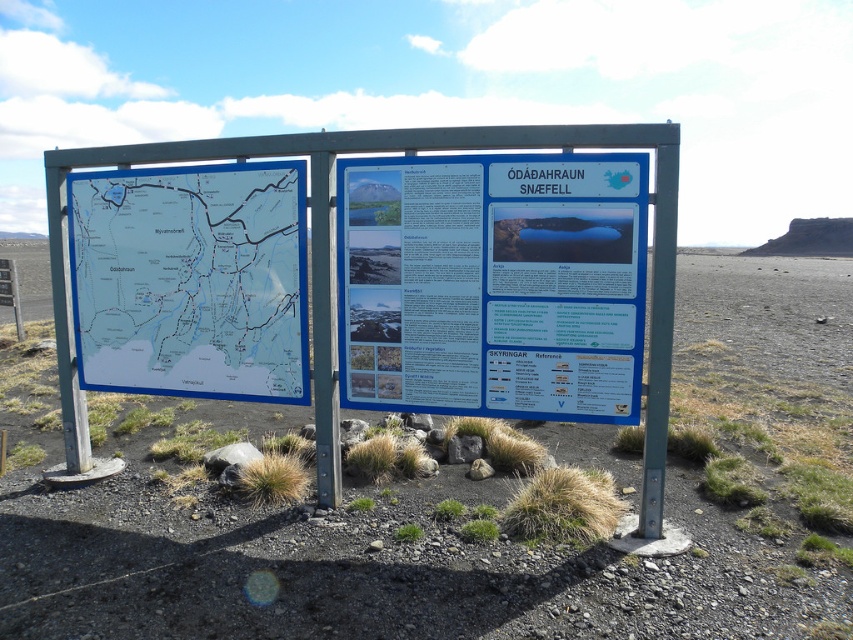
Question: Which object appears closest to the camera in this image?

Choices:
 (A) black gravel desert at center
 (B) blue paper map at left

Answer: (A)

Question: Is blue paper map at left to the right of metallic pole at center from the viewer's perspective?

Choices:
 (A) no
 (B) yes

Answer: (A)

Question: Which object is closer to the camera taking this photo?

Choices:
 (A) metallic pole at center
 (B) black gravel desert at center
 (C) blue paper map at left
 (D) white paper sign at center

Answer: (B)

Question: Does black gravel desert at center appear over blue paper map at left?

Choices:
 (A) no
 (B) yes

Answer: (A)

Question: Which object is closer to the camera taking this photo?

Choices:
 (A) black gravel desert at center
 (B) white paper sign at center
 (C) blue paper map at left

Answer: (A)

Question: Can you confirm if black gravel desert at center is wider than white paper sign at center?

Choices:
 (A) no
 (B) yes

Answer: (B)